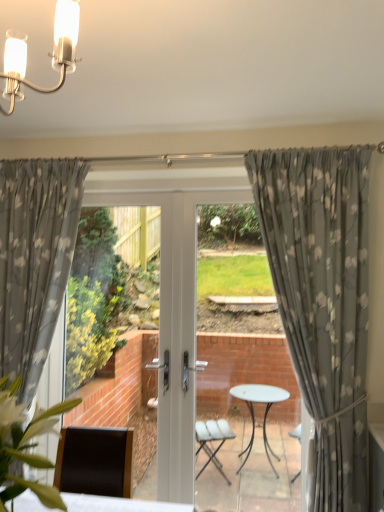
Question: Is green leafy plant at lower left taller than gray floral fabric curtain at center, which is counted as the 2th curtain, starting from the left?

Choices:
 (A) no
 (B) yes

Answer: (A)

Question: Considering the relative sizes of green leafy plant at lower left and gray floral fabric curtain at center, the first curtain viewed from the right, in the image provided, is green leafy plant at lower left bigger than gray floral fabric curtain at center, the first curtain viewed from the right,?

Choices:
 (A) yes
 (B) no

Answer: (B)

Question: Could you tell me if green leafy plant at lower left is turned towards gray floral fabric curtain at center, which is counted as the 2th curtain, starting from the left?

Choices:
 (A) yes
 (B) no

Answer: (B)

Question: Is green leafy plant at lower left touching gray floral fabric curtain at center, the first curtain viewed from the right?

Choices:
 (A) yes
 (B) no

Answer: (B)

Question: Can you confirm if green leafy plant at lower left is wider than gray floral fabric curtain at center, the first curtain viewed from the right?

Choices:
 (A) yes
 (B) no

Answer: (A)

Question: Considering their positions, is gray floral curtain at left, which is the first curtain in left-to-right order, located in front of or behind white glossy light fixture at upper left?

Choices:
 (A) front
 (B) behind

Answer: (B)

Question: Considering the positions of gray floral curtain at left, which ranks as the 2th curtain in right-to-left order, and white glossy light fixture at upper left in the image, is gray floral curtain at left, which ranks as the 2th curtain in right-to-left order, taller or shorter than white glossy light fixture at upper left?

Choices:
 (A) tall
 (B) short

Answer: (A)

Question: Considering the positions of point (77, 169) and point (23, 78), is point (77, 169) closer or farther from the camera than point (23, 78)?

Choices:
 (A) closer
 (B) farther

Answer: (B)

Question: From the image's perspective, is gray floral curtain at left, which is the first curtain in left-to-right order, above or below white glossy light fixture at upper left?

Choices:
 (A) above
 (B) below

Answer: (B)

Question: Considering their positions, is green leafy plant at lower left located in front of or behind white glossy light fixture at upper left?

Choices:
 (A) behind
 (B) front

Answer: (B)

Question: Would you say green leafy plant at lower left is to the left or to the right of white glossy light fixture at upper left in the picture?

Choices:
 (A) left
 (B) right

Answer: (A)

Question: Considering the positions of green leafy plant at lower left and white glossy light fixture at upper left in the image, is green leafy plant at lower left taller or shorter than white glossy light fixture at upper left?

Choices:
 (A) tall
 (B) short

Answer: (A)

Question: From the image's perspective, is green leafy plant at lower left above or below white glossy light fixture at upper left?

Choices:
 (A) below
 (B) above

Answer: (A)

Question: Does point (59, 16) appear closer or farther from the camera than point (324, 181)?

Choices:
 (A) farther
 (B) closer

Answer: (B)

Question: Is white glossy light fixture at upper left to the left or to the right of gray floral fabric curtain at center, the first curtain viewed from the right, in the image?

Choices:
 (A) right
 (B) left

Answer: (B)